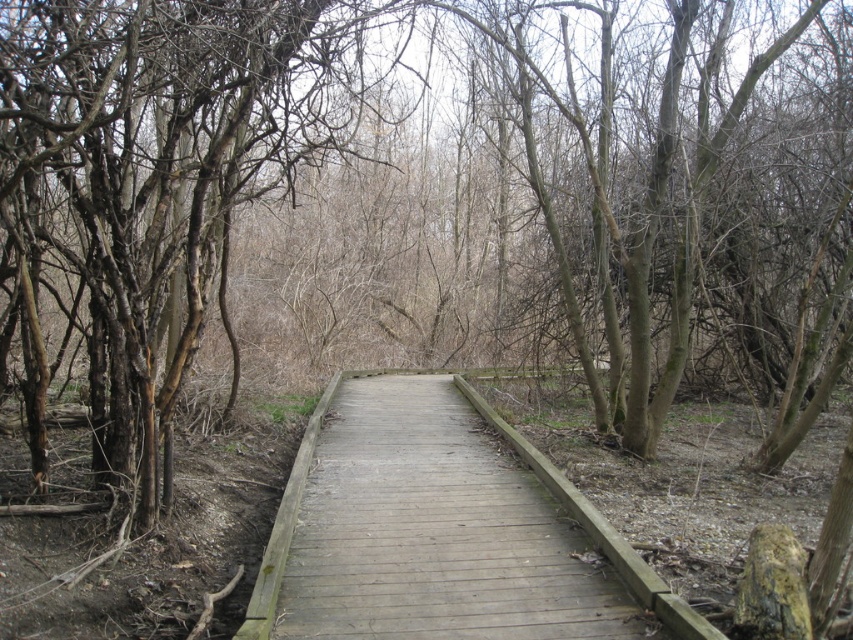
You are a hiker who wants to cross the wooden boardwalk at center but notices the brown bark tree at left nearby. Considering their widths, which one is wider?

The brown bark tree at left is wider than the wooden boardwalk at center since its width surpasses the boardwalk.

You are a hiker walking along the wooden boardwalk at center and notice a brown bark tree at left. From your perspective, is the tree positioned higher or lower than the boardwalk?

The brown bark tree at left is located above the wooden boardwalk at center, so from your perspective, the tree is positioned higher than the boardwalk.